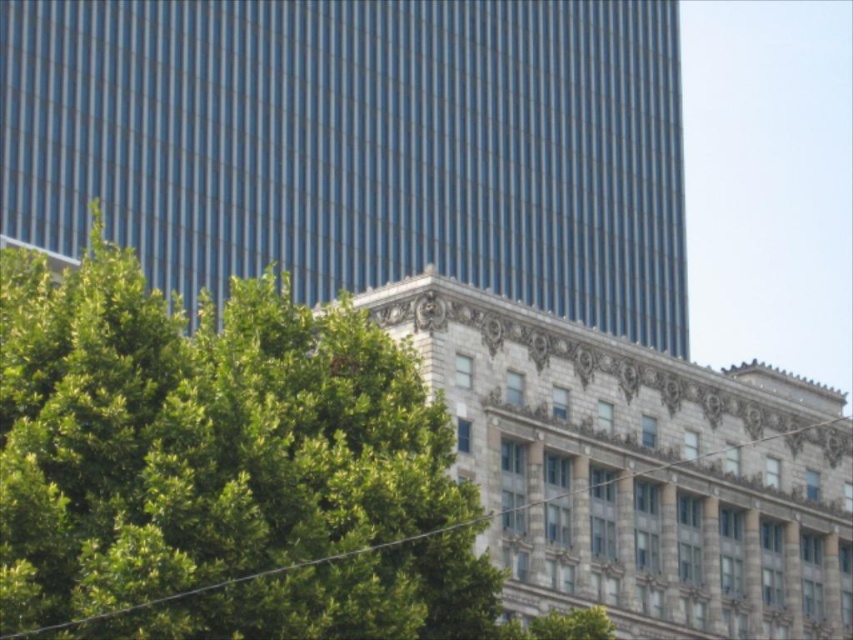
You are standing at the center of the image and want to take a photo of the glassy blue skyscraper at upper left. Which direction should you point your camera to capture it?

The glassy blue skyscraper at upper left is located at point (358, 145), which is to the upper left of the center. Therefore, you should point your camera towards the upper left direction to capture it.

You are standing in the middle of the scene looking towards the glassy blue skyscraper at upper left and the green leafy tree at lower left. Which object is higher in your field of view?

The glassy blue skyscraper at upper left is higher in your field of view because it is positioned above the green leafy tree at lower left.

You are a drone operator who needs to fly a drone from the green leafy tree at lower left to the glassy blue skyscraper at upper left. What is the minimum horizontal distance you need to cover?

The minimum horizontal distance you need to cover is 25.22 meters between the green leafy tree at lower left and the glassy blue skyscraper at upper left.